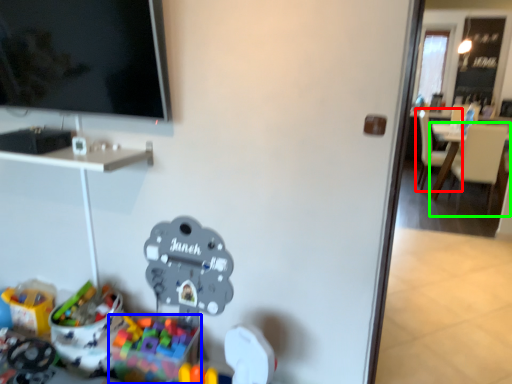
Question: Which object is positioned farthest from chair (highlighted by a red box)? Select from toy (highlighted by a blue box) and chair (highlighted by a green box).

Choices:
 (A) toy
 (B) chair

Answer: (A)